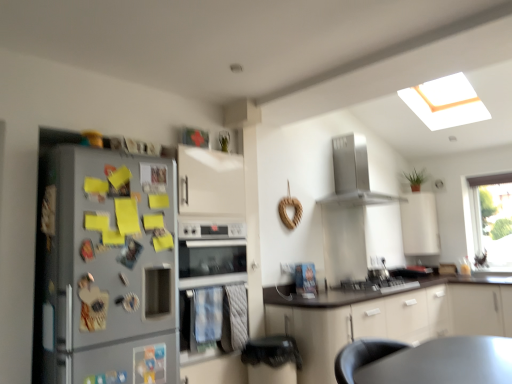
I want to click on silver metallic oven at center, so click(212, 283).

Is satin silver gas stove at center next to silver metallic refrigerator at left and touching it?

No.

Locate an element on the screen. refrigerator on the left of satin silver gas stove at center is located at coordinates (109, 268).

Does satin silver gas stove at center contain silver metallic refrigerator at left?

No, silver metallic refrigerator at left is not a part of satin silver gas stove at center.

Which of these two, transparent glass window at upper right or silver metallic refrigerator at left, is smaller?

With smaller size is transparent glass window at upper right.

Considering the positions of objects transparent glass window at upper right and silver metallic refrigerator at left in the image provided, who is more to the right, transparent glass window at upper right or silver metallic refrigerator at left?

transparent glass window at upper right.

Which object is more forward, transparent glass window at upper right or silver metallic refrigerator at left?

silver metallic refrigerator at left is in front.

Between point (382, 282) and point (323, 323), which one is positioned in front?

The point (323, 323) is more forward.

Is satin silver gas stove at center far from white matte cabinet at center, which is the 2th cabinetry in top-to-bottom order?

satin silver gas stove at center is near white matte cabinet at center, which is the 2th cabinetry in top-to-bottom order, not far away.

Can you confirm if satin silver gas stove at center is smaller than white matte cabinet at center, arranged as the 1th cabinetry when ordered from the bottom?

Indeed, satin silver gas stove at center has a smaller size compared to white matte cabinet at center, arranged as the 1th cabinetry when ordered from the bottom.

Does satin silver gas stove at center have a greater width compared to white matte cabinet at center, which is the 2th cabinetry in top-to-bottom order?

No, satin silver gas stove at center is not wider than white matte cabinet at center, which is the 2th cabinetry in top-to-bottom order.

Is satin silver gas stove at center beside white matte cabinet at upper right, the 2th cabinetry ordered from the bottom?

No, satin silver gas stove at center is not beside white matte cabinet at upper right, the 2th cabinetry ordered from the bottom.

Considering the relative sizes of satin silver gas stove at center and white matte cabinet at upper right, the 2th cabinetry ordered from the bottom, in the image provided, is satin silver gas stove at center taller than white matte cabinet at upper right, the 2th cabinetry ordered from the bottom,?

In fact, satin silver gas stove at center may be shorter than white matte cabinet at upper right, the 2th cabinetry ordered from the bottom.

From the image's perspective, does satin silver gas stove at center appear higher than white matte cabinet at upper right, the 2th cabinetry ordered from the bottom?

Actually, satin silver gas stove at center appears below white matte cabinet at upper right, the 2th cabinetry ordered from the bottom, in the image.

Can you confirm if satin silver gas stove at center is wider than white matte cabinet at upper right, the 2th cabinetry in the front-to-back sequence?

Yes.

Does point (281, 313) come farther from viewer compared to point (495, 191)?

No, it is not.

From the image's perspective, which is below, white matte cabinet at center, which appears as the second cabinetry when viewed from the back, or transparent glass window at upper right?

white matte cabinet at center, which appears as the second cabinetry when viewed from the back, from the image's perspective.

Is white matte cabinet at center, arranged as the 1th cabinetry when ordered from the bottom, beside transparent glass window at upper right?

No, white matte cabinet at center, arranged as the 1th cabinetry when ordered from the bottom, is not beside transparent glass window at upper right.

Which is more to the left, silver metallic refrigerator at left or transparent glass window at upper right?

From the viewer's perspective, silver metallic refrigerator at left appears more on the left side.

Is silver metallic refrigerator at left inside the boundaries of transparent glass window at upper right, or outside?

silver metallic refrigerator at left is outside transparent glass window at upper right.

Considering the positions of points (148, 316) and (505, 205), is point (148, 316) closer to camera compared to point (505, 205)?

Yes, it is.

Is silver metallic refrigerator at left oriented away from transparent glass window at upper right?

No, transparent glass window at upper right is not at the back of silver metallic refrigerator at left.

From a real-world perspective, is silver metallic oven at center positioned under silver metallic refrigerator at left based on gravity?

Yes.

Considering the positions of objects silver metallic oven at center and silver metallic refrigerator at left in the image provided, who is more to the left, silver metallic oven at center or silver metallic refrigerator at left?

silver metallic refrigerator at left is more to the left.

From the image's perspective, is silver metallic oven at center located above or below silver metallic refrigerator at left?

Based on their image positions, silver metallic oven at center is located beneath silver metallic refrigerator at left.

What's the angular difference between silver metallic oven at center and silver metallic refrigerator at left's facing directions?

0.5 degrees.

At what (x,y) coordinates should I click in order to perform the action: click on gas stove directly beneath the silver metallic refrigerator at left (from a real-world perspective). Please return your answer as a coordinate pair (x, y). The width and height of the screenshot is (512, 384). Looking at the image, I should click on (377, 284).

Identify the location of window above the silver metallic refrigerator at left (from a real-world perspective). (490, 221).

Looking at the image, which one is located further to satin silver range hood at upper center, silver metallic oven at center or silver metallic refrigerator at left?

silver metallic refrigerator at left is further to satin silver range hood at upper center.

Considering their positions, is satin silver gas stove at center positioned closer to silver metallic oven at center than white matte cabinet at center, which appears as the second cabinetry when viewed from the back?

Based on the image, white matte cabinet at center, which appears as the second cabinetry when viewed from the back, appears to be nearer to silver metallic oven at center.

Estimate the real-world distances between objects in this image. Which object is closer to satin silver gas stove at center, white matte cabinet at center, the 1th cabinetry from the front, or transparent glass window at upper right?

white matte cabinet at center, the 1th cabinetry from the front.

Considering their positions, is silver metallic oven at center positioned closer to satin silver gas stove at center than white matte cabinet at center, arranged as the 1th cabinetry when ordered from the bottom?

white matte cabinet at center, arranged as the 1th cabinetry when ordered from the bottom.

Based on their spatial positions, is white matte cabinet at upper right, the first cabinetry viewed from the back, or transparent glass window at upper right closer to satin silver gas stove at center?

The object closer to satin silver gas stove at center is white matte cabinet at upper right, the first cabinetry viewed from the back.

Considering their positions, is white matte cabinet at center, arranged as the 1th cabinetry when ordered from the bottom, positioned closer to transparent glass window at upper right than silver metallic oven at center?

white matte cabinet at center, arranged as the 1th cabinetry when ordered from the bottom, is closer to transparent glass window at upper right.

Which object lies nearer to the anchor point white matte cabinet at center, arranged as the 1th cabinetry when ordered from the bottom, silver metallic refrigerator at left or satin silver range hood at upper center?

satin silver range hood at upper center.

Estimate the real-world distances between objects in this image. Which object is closer to white matte cabinet at upper right, the 1th cabinetry when ordered from top to bottom, transparent glass window at upper right or silver metallic refrigerator at left?

The object closer to white matte cabinet at upper right, the 1th cabinetry when ordered from top to bottom, is transparent glass window at upper right.

Find the location of `window located between white matte cabinet at center, arranged as the 1th cabinetry when ordered from the bottom, and white matte cabinet at upper right, the 2th cabinetry ordered from the bottom, in the depth direction`. window located between white matte cabinet at center, arranged as the 1th cabinetry when ordered from the bottom, and white matte cabinet at upper right, the 2th cabinetry ordered from the bottom, in the depth direction is located at coordinates coord(490,221).

Where is `home appliance between white matte cabinet at center, which appears as the second cabinetry when viewed from the back, and white matte cabinet at upper right, the 2th cabinetry ordered from the bottom, along the z-axis`? The width and height of the screenshot is (512, 384). home appliance between white matte cabinet at center, which appears as the second cabinetry when viewed from the back, and white matte cabinet at upper right, the 2th cabinetry ordered from the bottom, along the z-axis is located at coordinates (353, 174).

Find the location of `home appliance between silver metallic oven at center and transparent glass window at upper right from left to right`. home appliance between silver metallic oven at center and transparent glass window at upper right from left to right is located at coordinates (353, 174).

I want to click on oven positioned between silver metallic refrigerator at left and white matte cabinet at upper right, the first cabinetry viewed from the back, from near to far, so (212, 283).